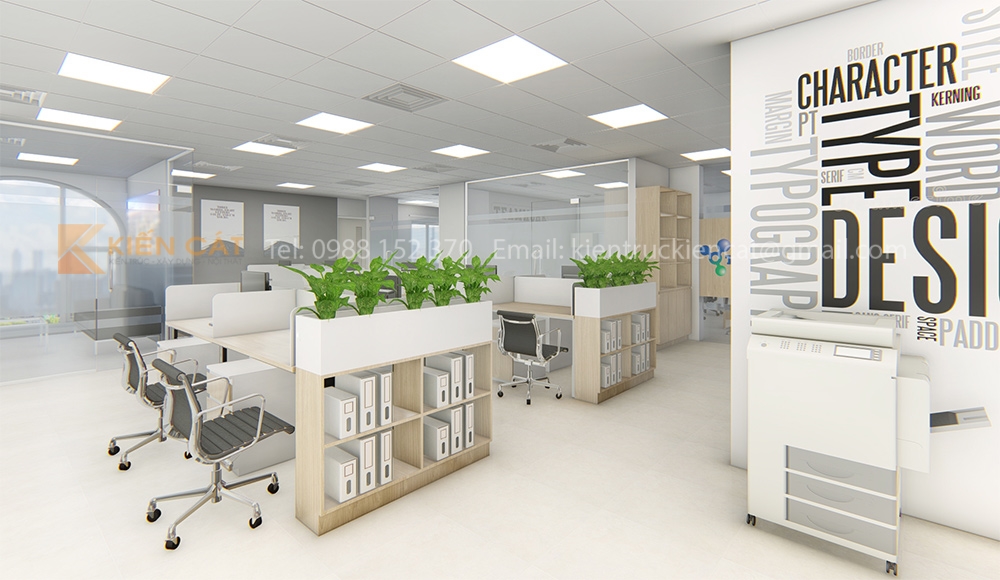
At what (x,y) coordinates should I click in order to perform the action: click on hvac vent. Please return your answer as a coordinate pair (x, y). This screenshot has height=580, width=1000. Looking at the image, I should click on (401, 99), (561, 146), (283, 146), (434, 172), (31, 95), (13, 134), (220, 168), (361, 184).